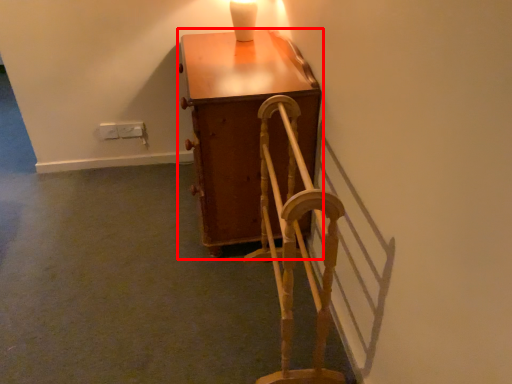
Question: Observing the image, what is the correct spatial positioning of furniture (annotated by the red box) in reference to rocking chair?

Choices:
 (A) right
 (B) left

Answer: (B)